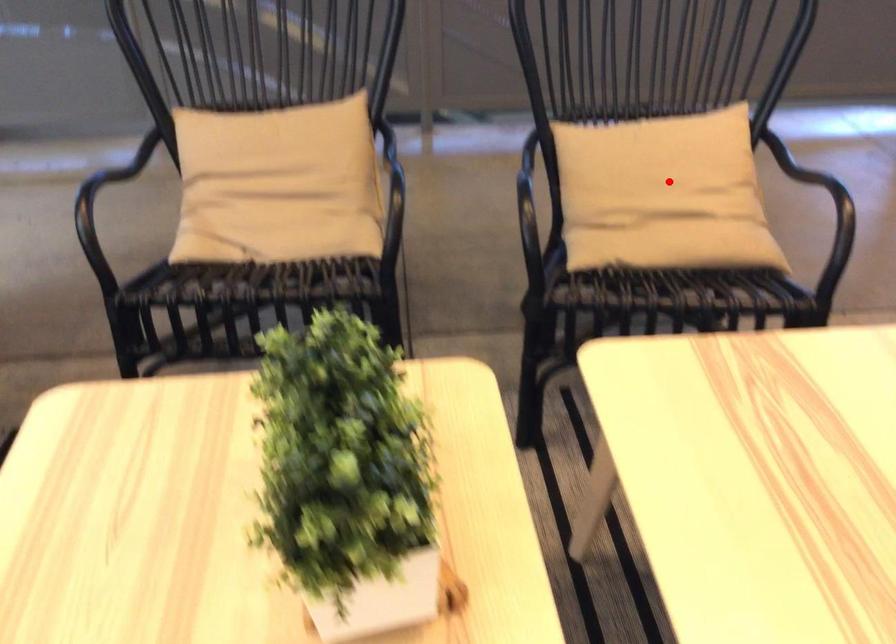
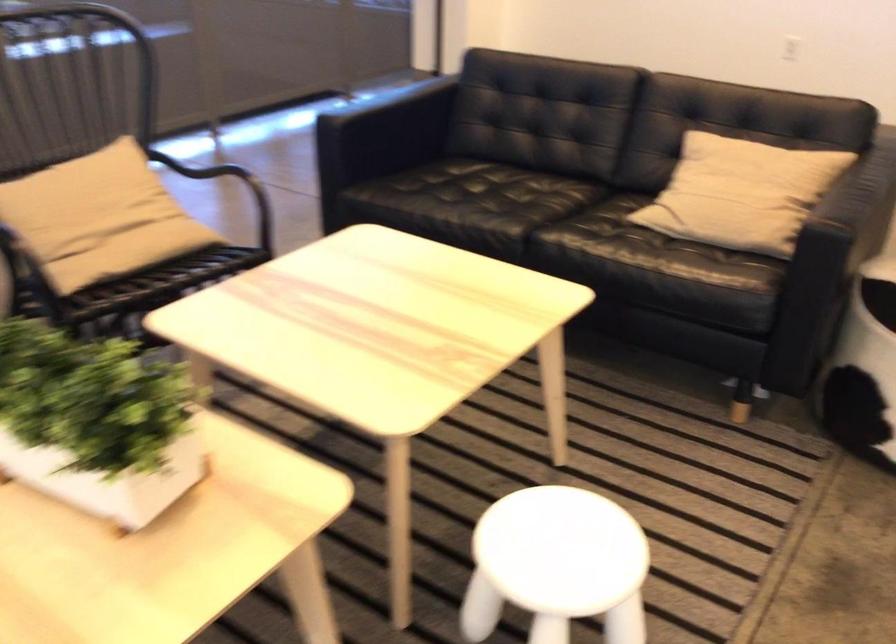
In the second image, find the point that corresponds to the highlighted location in the first image.

(99, 214)